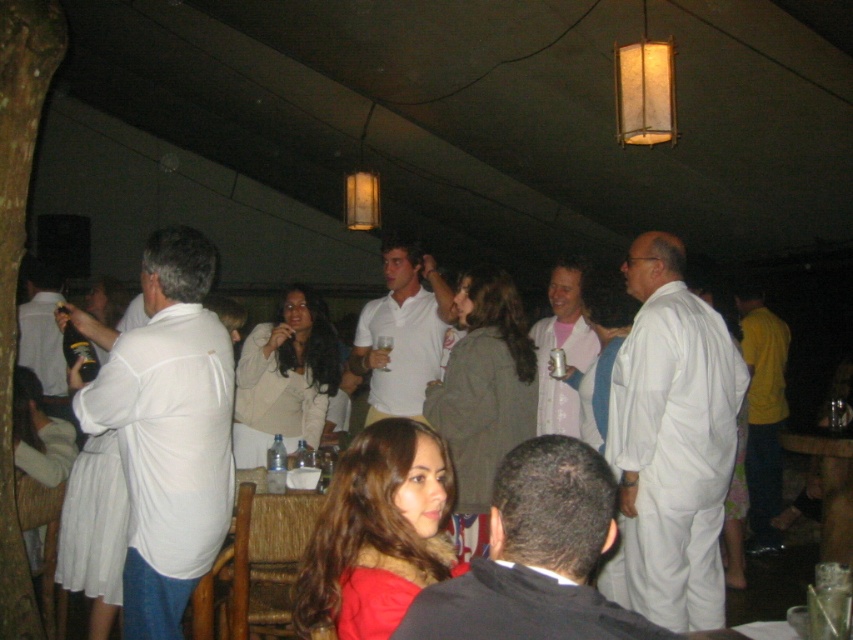
Who is taller, black matte suit at center or metallic can at center?

With more height is black matte suit at center.

Does black matte suit at center have a smaller size compared to metallic can at center?

Incorrect, black matte suit at center is not smaller in size than metallic can at center.

Find the location of a particular element. The image size is (853, 640). black matte suit at center is located at coordinates (537, 556).

Identify the location of black matte suit at center. (537, 556).

Does white smooth suit at right appear on the left side of yellow cotton shirt at right?

Correct, you'll find white smooth suit at right to the left of yellow cotton shirt at right.

Is point (698, 609) behind point (743, 307)?

No.

In order to click on white smooth suit at right in this screenshot , I will do `click(672, 440)`.

Who is higher up, black matte suit at center or matte white shirt at left?

matte white shirt at left is above.

Consider the image. Which of these two, black matte suit at center or matte white shirt at left, stands shorter?

black matte suit at center

Between point (563, 467) and point (56, 298), which one is positioned behind?

The point (56, 298) is behind.

At what (x,y) coordinates should I click in order to perform the action: click on black matte suit at center. Please return your answer as a coordinate pair (x, y). Looking at the image, I should click on (537, 556).